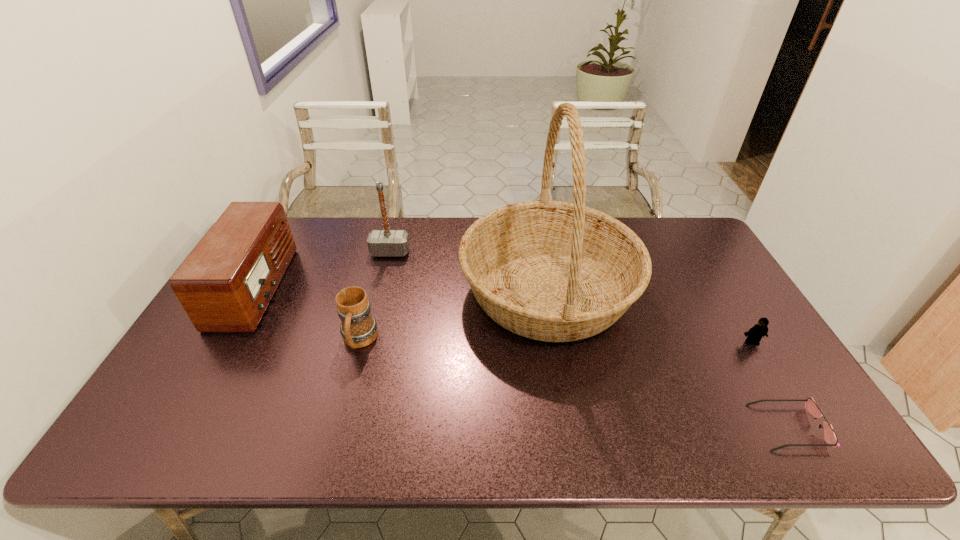
I want to click on free location located 0.110m on the striking surface of the hammer, so click(x=383, y=281).

Image resolution: width=960 pixels, height=540 pixels. In order to click on vacant point located on the front-facing side of the leftmost object in this screenshot , I will do `click(318, 287)`.

Image resolution: width=960 pixels, height=540 pixels. Find the location of `vacant position located 0.100m on the side of the mug with the handle`. vacant position located 0.100m on the side of the mug with the handle is located at coordinates (345, 394).

Where is `vacant space located 0.090m on the face of the Lego`? The height and width of the screenshot is (540, 960). vacant space located 0.090m on the face of the Lego is located at coordinates (770, 373).

Where is `vacant area located on the bridge of the nearest object`? vacant area located on the bridge of the nearest object is located at coordinates (735, 427).

Image resolution: width=960 pixels, height=540 pixels. I want to click on vacant space located on the bridge of the nearest object, so click(x=621, y=427).

This screenshot has width=960, height=540. Find the location of `vacant space located 0.270m on the bridge of the nearest object`. vacant space located 0.270m on the bridge of the nearest object is located at coordinates (639, 427).

Find the location of a particular element. The width and height of the screenshot is (960, 540). basket that is at the far edge is located at coordinates (553, 271).

This screenshot has width=960, height=540. What are the coordinates of `hammer at the far edge` in the screenshot? It's located at (386, 242).

Identify the location of radio receiver that is at the far edge. Image resolution: width=960 pixels, height=540 pixels. click(x=226, y=283).